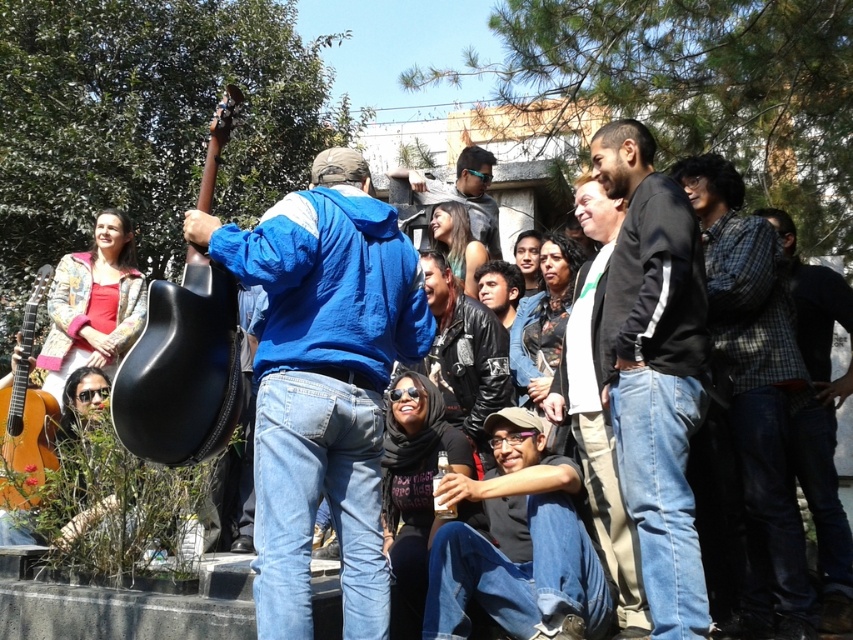
You are a photographer trying to capture a candid shot of the two central figures in the scene. The black fleece jacket at center and the checkered fabric shirt at center are both in your frame. Based on their positions, which one is closer to the camera?

The black fleece jacket at center is above the checkered fabric shirt at center, so it is closer to the camera.

You are a photographer at this event and want to take a photo of both the central guitarist and a person sitting on the steps. The guitarist is at point (x=732, y=236) and the person on the steps is at point (x=618, y=515). Which point is closer to the camera so you can focus properly?

Point (x=732, y=236) is closer to the camera than point (x=618, y=515), so focus on that point first.